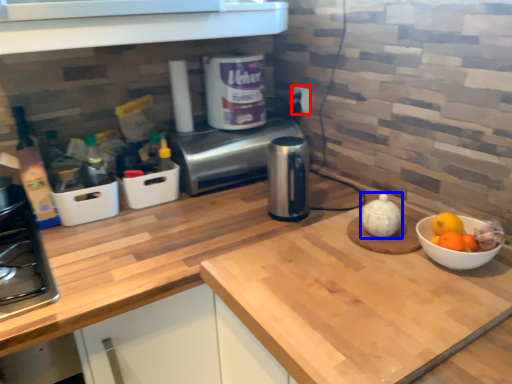
Question: Among these objects, which one is nearest to the camera, electric outlet (highlighted by a red box) or tea pot (highlighted by a blue box)?

Choices:
 (A) electric outlet
 (B) tea pot

Answer: (B)